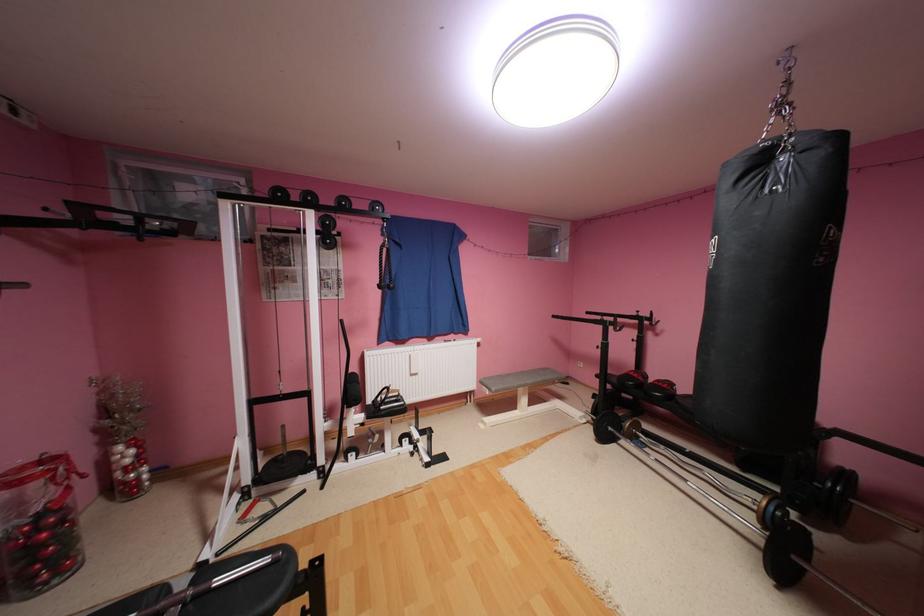
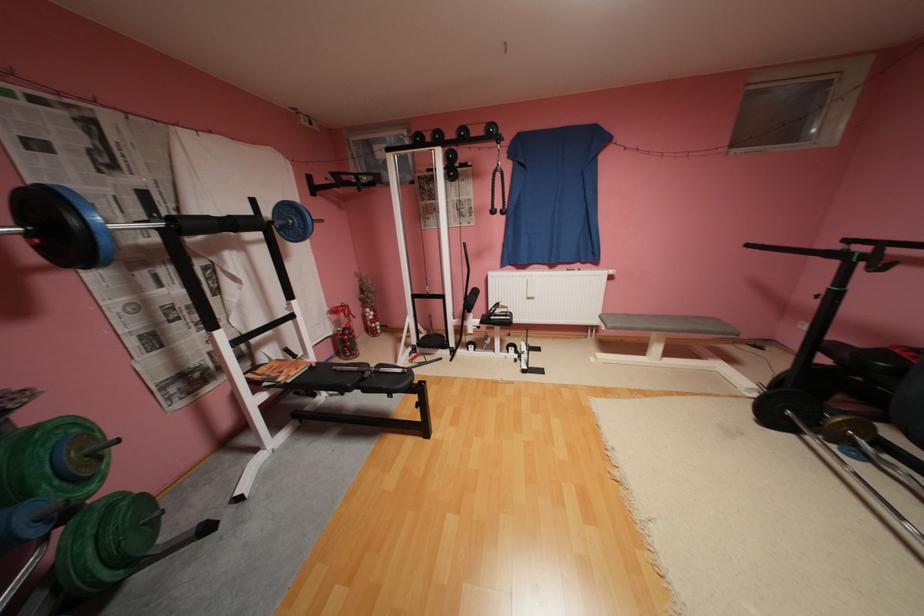
The point at (532,383) is marked in the first image. Where is the corresponding point in the second image?

(664, 326)